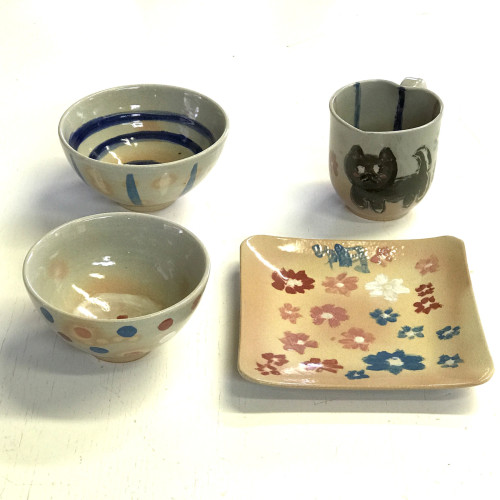
I want to click on table, so (x=200, y=414).